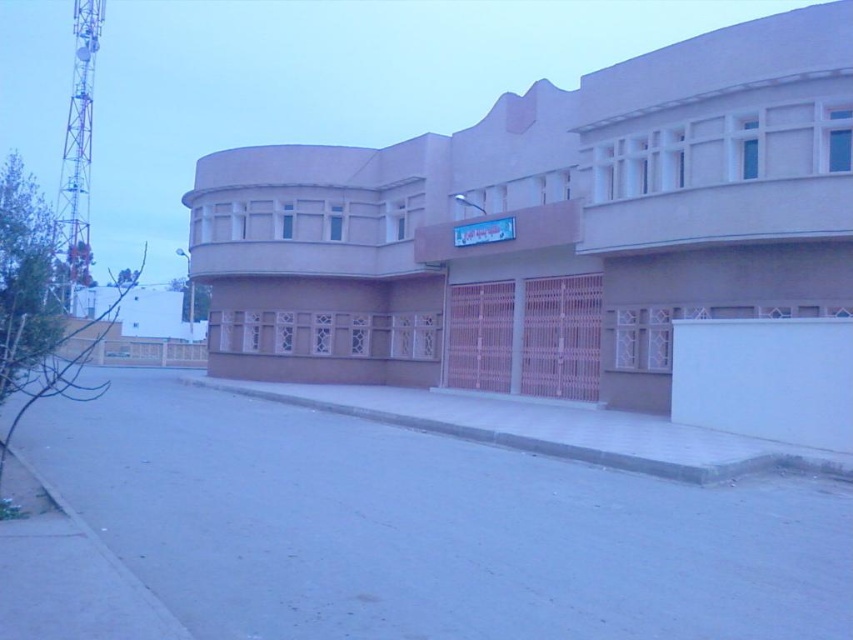
You are standing on the gray concrete curb at lower center and want to enter the beige concrete building at center. Which direction should you walk to reach the entrance?

You should walk to the right because the beige concrete building at center is located to the left of the gray concrete curb at lower center, so moving right will lead you towards it.

You are standing on the street in front of the beige concrete building at center and the gray concrete curb at lower center. Which object is closer to your eye level when you look straight ahead?

The beige concrete building at center is closer to your eye level because it is located above the gray concrete curb at lower center, meaning it is higher up in your field of view.

You are standing on the gray concrete curb at lower center and want to walk towards the beige concrete building at center. Which direction should you face to move directly toward it?

Since the beige concrete building at center is further to the viewer than the gray concrete curb at lower center, you should face away from the curb and walk forward towards the building.